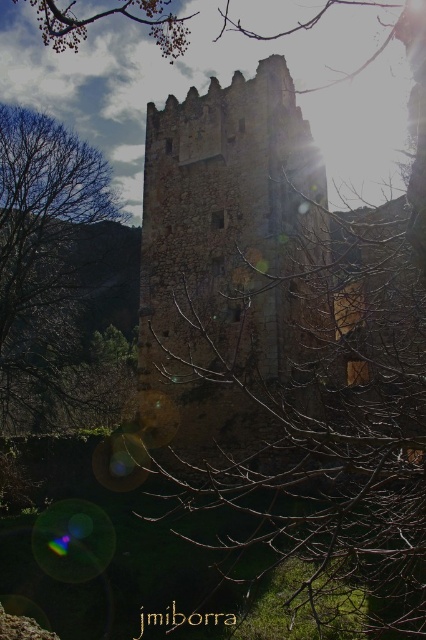
Question: Can you confirm if stone tower at center is positioned to the left of brown leafless tree at left?

Choices:
 (A) no
 (B) yes

Answer: (A)

Question: Which point is farther from the camera taking this photo?

Choices:
 (A) (86, 323)
 (B) (279, 317)

Answer: (A)

Question: Can you confirm if stone tower at center is thinner than brown leafless tree at left?

Choices:
 (A) no
 (B) yes

Answer: (A)

Question: Can you confirm if stone tower at center is thinner than brown leafless tree at left?

Choices:
 (A) yes
 (B) no

Answer: (B)